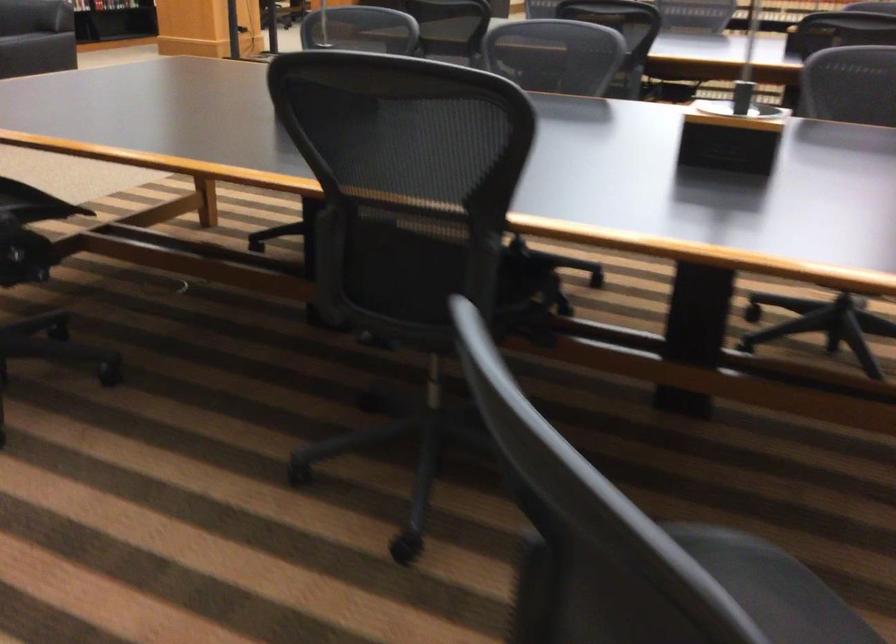
Describe the element at coordinates (39, 46) in the screenshot. This screenshot has height=644, width=896. I see `the sofa sitting surface` at that location.